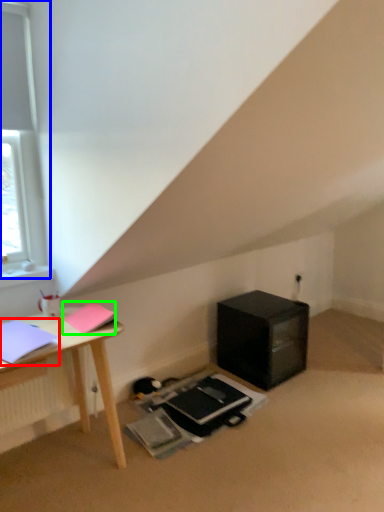
Question: Estimate the real-world distances between objects in this image. Which object is closer to notebook (highlighted by a red box), window (highlighted by a blue box) or notebook (highlighted by a green box)?

Choices:
 (A) window
 (B) notebook

Answer: (B)